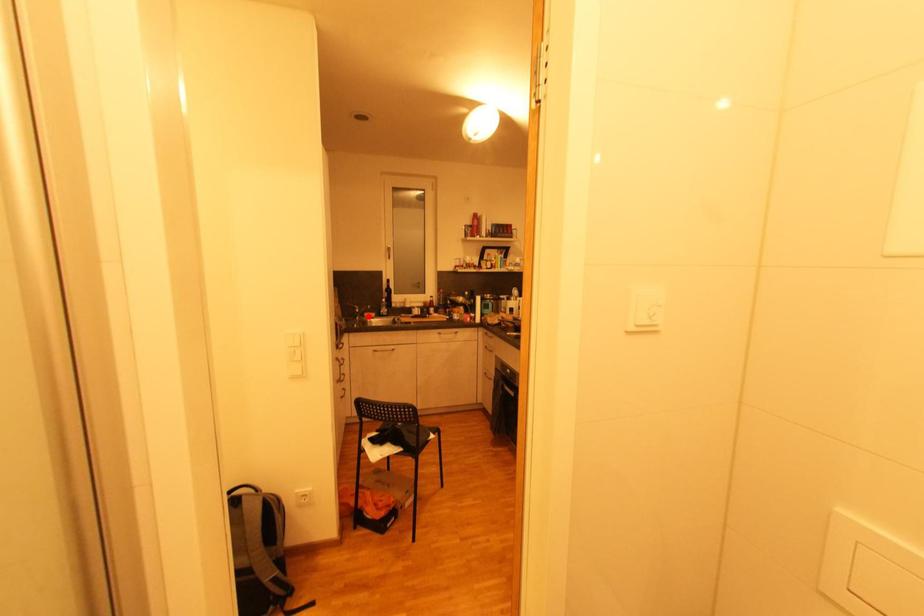
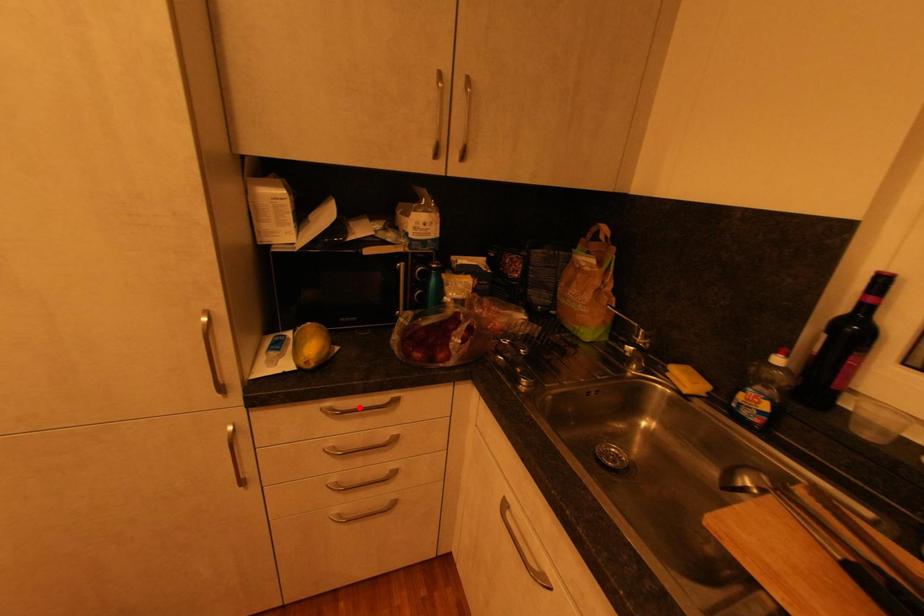
I am providing you with two images of the same scene from different viewpoints. A red point is marked on the first image and another point is marked on the second image. Do the highlighted points in image1 and image2 indicate the same real-world spot?

No